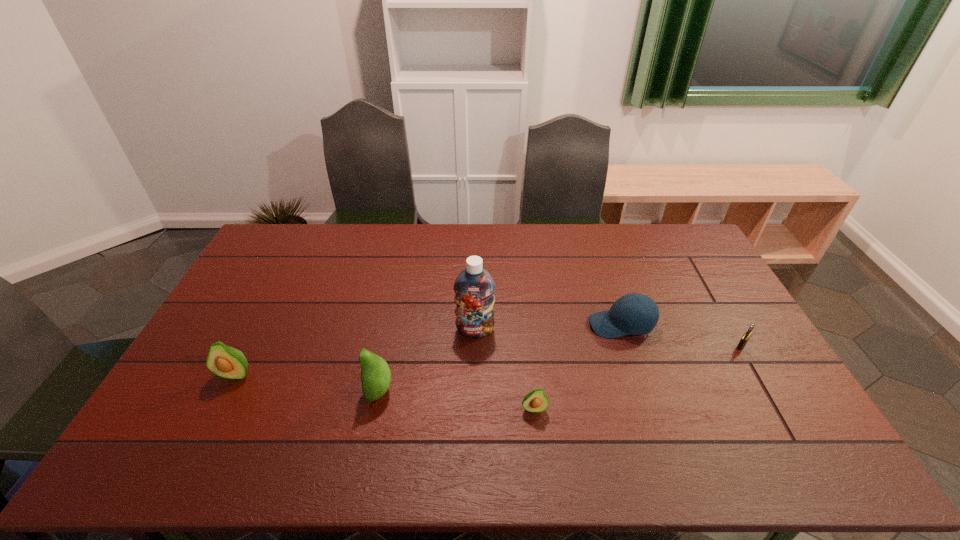
Locate an element on the screen. This screenshot has width=960, height=540. free space that satisfies the following two spatial constraints: 1. on the front-facing side of the fifth object from left to right; 2. on the cut side of the leftmost object is located at coordinates (637, 374).

At what (x,y) coordinates should I click in order to perform the action: click on free spot that satisfies the following two spatial constraints: 1. on the front side of the fourth nearest object; 2. on the cut side of the second object from left to right. Please return your answer as a coordinate pair (x, y). The height and width of the screenshot is (540, 960). Looking at the image, I should click on (767, 390).

This screenshot has height=540, width=960. Find the location of `free spot that satisfies the following two spatial constraints: 1. on the front-facing side of the baseball cap; 2. on the cut side of the shortest avocado`. free spot that satisfies the following two spatial constraints: 1. on the front-facing side of the baseball cap; 2. on the cut side of the shortest avocado is located at coordinates (648, 408).

The image size is (960, 540). What are the coordinates of `vacant space that satisfies the following two spatial constraints: 1. on the back side of the padlock; 2. on the front-facing side of the fifth object from left to right` in the screenshot? It's located at (730, 325).

The width and height of the screenshot is (960, 540). I want to click on free space in the image that satisfies the following two spatial constraints: 1. on the front-facing side of the baseball cap; 2. on the cut side of the leftmost avocado, so click(x=637, y=374).